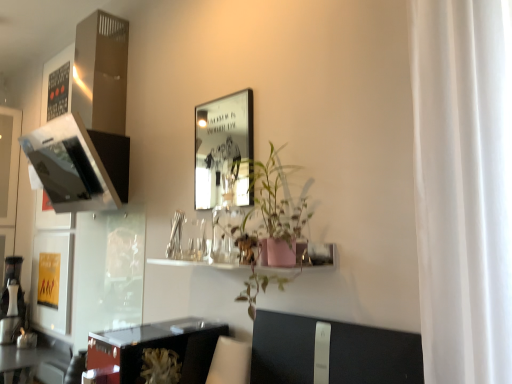
Question: Are shiny black table at lower left, which appears as the 1th table when viewed from the right, and pink matte shelf at center making contact?

Choices:
 (A) yes
 (B) no

Answer: (B)

Question: From the image's perspective, would you say shiny black table at lower left, placed as the 1th table when sorted from top to bottom, is shown under pink matte shelf at center?

Choices:
 (A) yes
 (B) no

Answer: (A)

Question: Does shiny black table at lower left, placed as the 2th table when sorted from back to front, lie behind pink matte shelf at center?

Choices:
 (A) yes
 (B) no

Answer: (B)

Question: Does shiny black table at lower left, which appears as the 1th table when viewed from the right, have a lesser width compared to pink matte shelf at center?

Choices:
 (A) yes
 (B) no

Answer: (B)

Question: Does shiny black table at lower left, placed as the second table when sorted from left to right, have a greater height compared to pink matte shelf at center?

Choices:
 (A) yes
 (B) no

Answer: (A)

Question: Is shiny black table at lower left, which is the 2th table in front-to-back order, wider or thinner than transparent glass door at lower left?

Choices:
 (A) thin
 (B) wide

Answer: (B)

Question: Based on their positions, is shiny black table at lower left, which is the 2th table in front-to-back order, located to the left or right of transparent glass door at lower left?

Choices:
 (A) left
 (B) right

Answer: (A)

Question: Relative to transparent glass door at lower left, is shiny black table at lower left, placed as the 1th table when sorted from back to front, in front or behind?

Choices:
 (A) front
 (B) behind

Answer: (A)

Question: Considering the positions of shiny black table at lower left, the 2th table in the top-to-bottom sequence, and transparent glass door at lower left in the image, is shiny black table at lower left, the 2th table in the top-to-bottom sequence, taller or shorter than transparent glass door at lower left?

Choices:
 (A) short
 (B) tall

Answer: (A)

Question: Considering the positions of shiny black table at lower left, the second table from the bottom, and white plastic swivel chair at lower center in the image, is shiny black table at lower left, the second table from the bottom, wider or thinner than white plastic swivel chair at lower center?

Choices:
 (A) wide
 (B) thin

Answer: (A)

Question: Considering the positions of shiny black table at lower left, the 1th table when ordered from front to back, and white plastic swivel chair at lower center in the image, is shiny black table at lower left, the 1th table when ordered from front to back, bigger or smaller than white plastic swivel chair at lower center?

Choices:
 (A) small
 (B) big

Answer: (B)

Question: From a real-world perspective, relative to white plastic swivel chair at lower center, is shiny black table at lower left, the 1th table when ordered from front to back, vertically above or below?

Choices:
 (A) above
 (B) below

Answer: (A)

Question: Considering the positions of shiny black table at lower left, placed as the 2th table when sorted from back to front, and white plastic swivel chair at lower center in the image, is shiny black table at lower left, placed as the 2th table when sorted from back to front, taller or shorter than white plastic swivel chair at lower center?

Choices:
 (A) tall
 (B) short

Answer: (B)

Question: Choose the correct answer: Is shiny black table at lower left, the 1th table viewed from the left, inside pink matte shelf at center or outside it?

Choices:
 (A) inside
 (B) outside

Answer: (B)

Question: Looking at their shapes, would you say shiny black table at lower left, placed as the 1th table when sorted from back to front, is wider or thinner than pink matte shelf at center?

Choices:
 (A) wide
 (B) thin

Answer: (A)